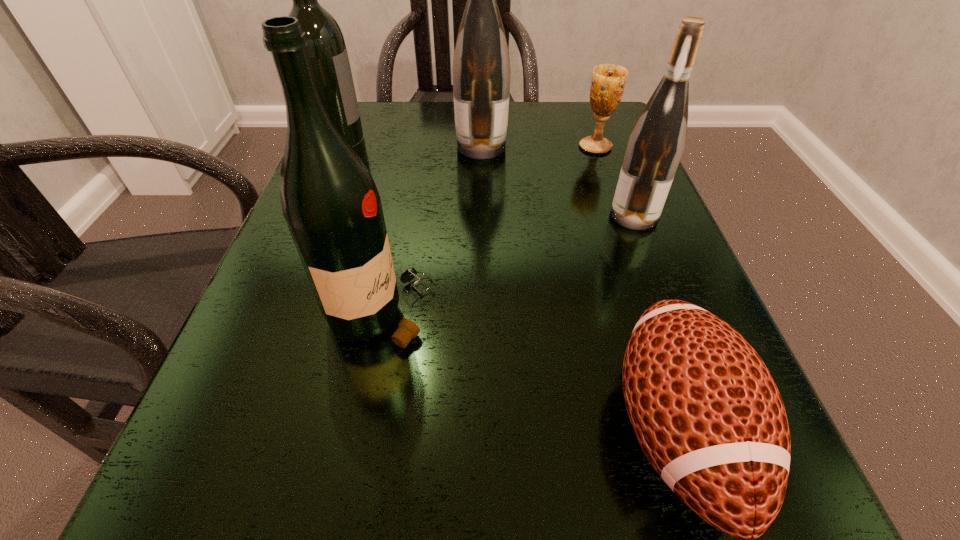
Locate an element on the screen. The image size is (960, 540). the second closest object to the second wine bottle from left to right is located at coordinates (327, 53).

Select which wine bottle is the second closest to the fourth object from right to left. Please provide its 2D coordinates. Your answer should be formatted as a tuple, i.e. [(x, y)], where the tuple contains the x and y coordinates of a point satisfying the conditions above.

[(656, 143)]

Select which wine bottle appears as the third closest to the rightmost wine bottle. Please provide its 2D coordinates. Your answer should be formatted as a tuple, i.e. [(x, y)], where the tuple contains the x and y coordinates of a point satisfying the conditions above.

[(327, 53)]

The image size is (960, 540). What are the coordinates of `free spot that satisfies the following two spatial constraints: 1. on the back side of the rightmost wine bottle; 2. on the label of the third wine bottle from left to right` in the screenshot? It's located at (608, 147).

At what (x,y) coordinates should I click in order to perform the action: click on vacant space that satisfies the following two spatial constraints: 1. on the label of the third nearest object; 2. on the right side of the leftmost object. Please return your answer as a coordinate pair (x, y). Looking at the image, I should click on (324, 215).

You are a GUI agent. You are given a task and a screenshot of the screen. Output one action in this format:
    pyautogui.click(x=<x>, y=<y>)
    Task: Click on the free space in the image that satisfies the following two spatial constraints: 1. on the label of the third nearest object; 2. on the right side of the second wine bottle from right to left
    The image size is (960, 540).
    Given the screenshot: What is the action you would take?
    pyautogui.click(x=482, y=215)